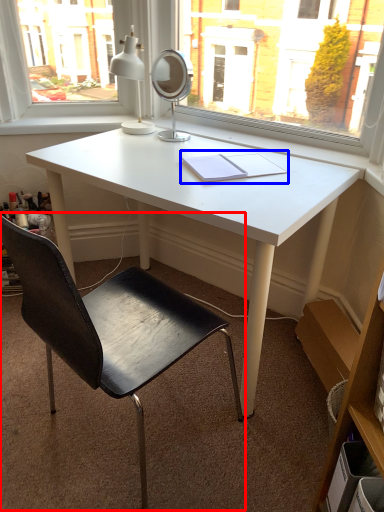
Question: Which of the following is the closest to the observer, chair (highlighted by a red box) or notebook (highlighted by a blue box)?

Choices:
 (A) chair
 (B) notebook

Answer: (A)